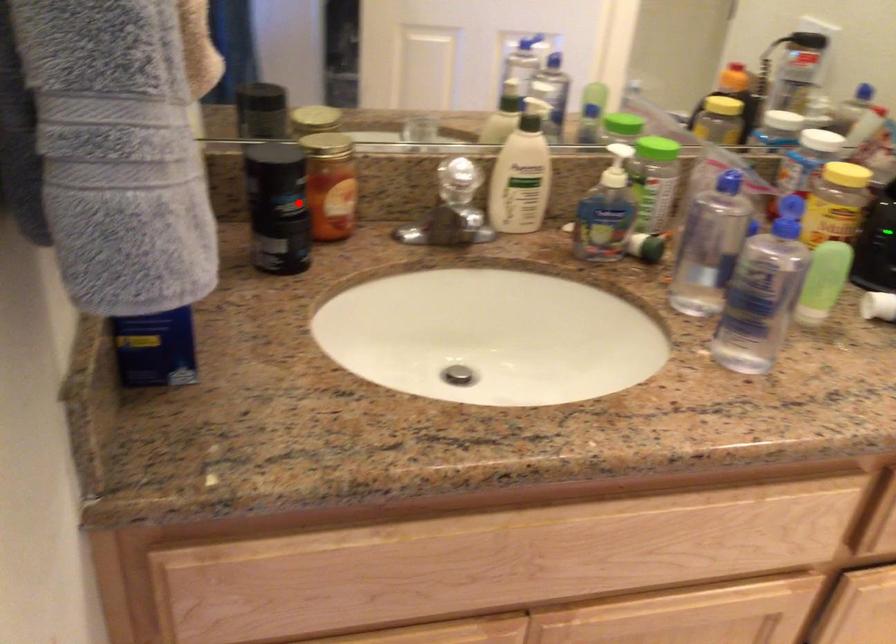
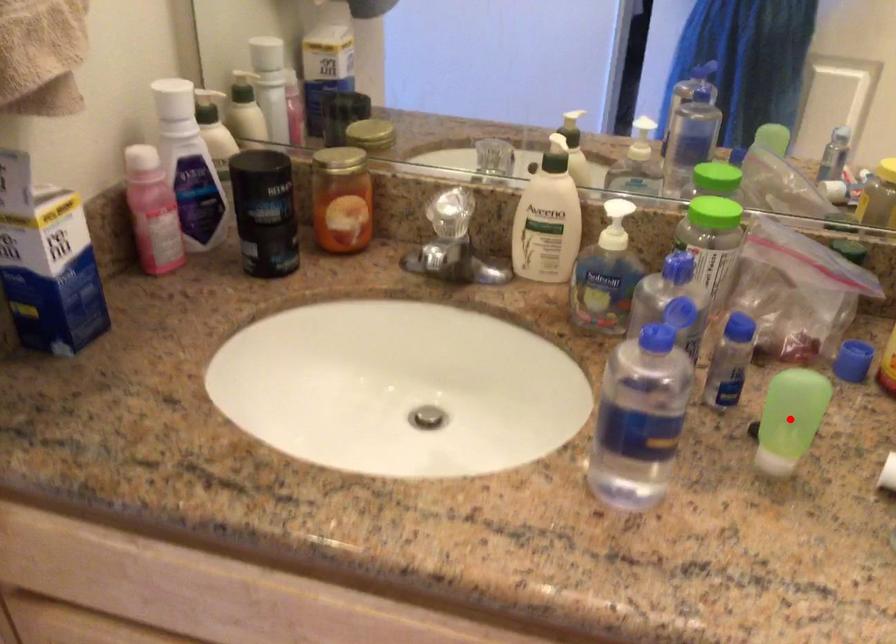
I am providing you with two images of the same scene from different viewpoints. A red point is marked on the first image and another point is marked on the second image. Are the points marked in image1 and image2 representing the same 3D position?

No